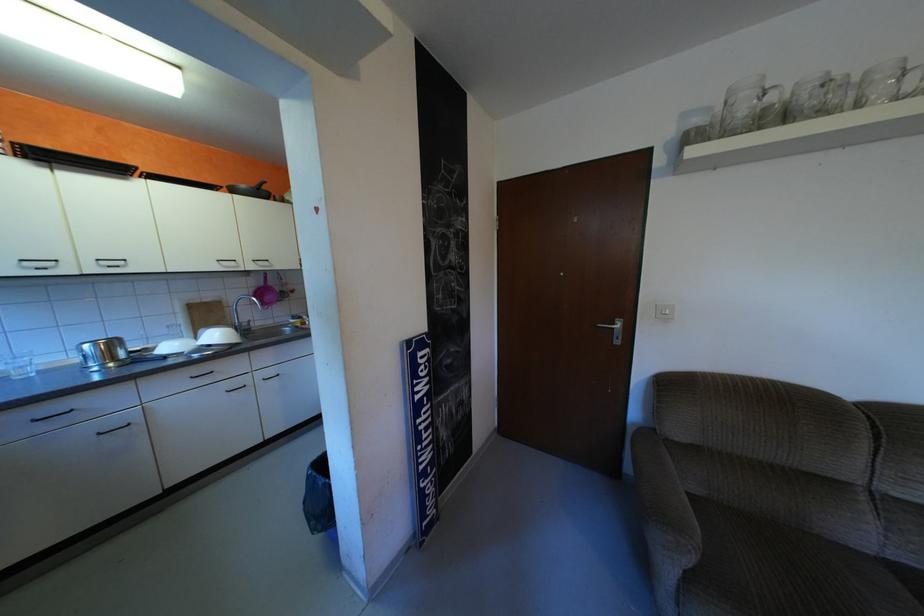
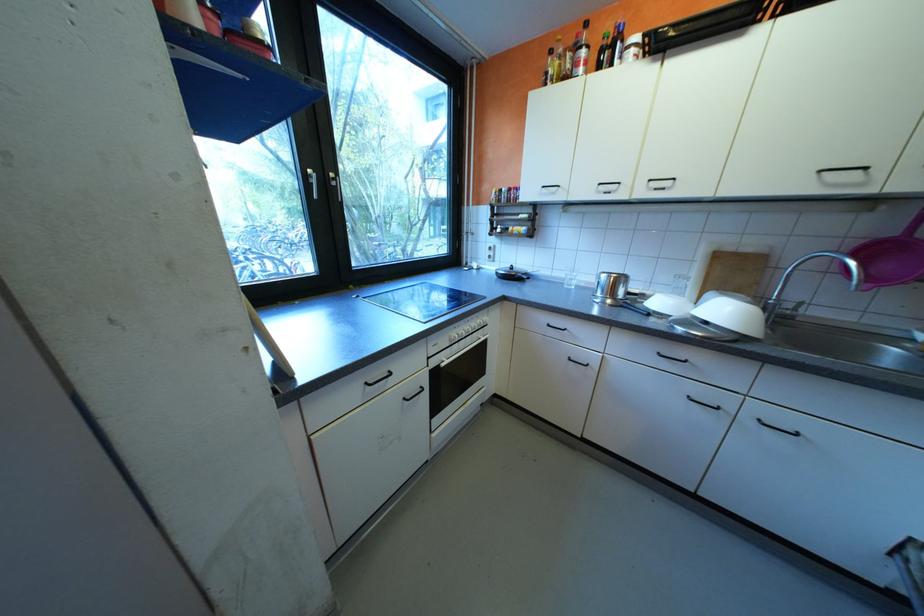
In the second image, find the point that corresponds to (106,369) in the first image.

(608, 300)